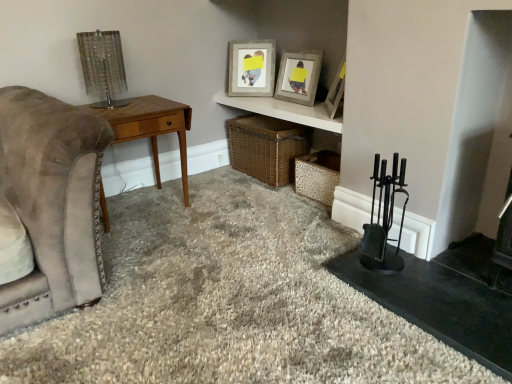
This screenshot has height=384, width=512. Find the location of `free region under metallic mesh lamp at upper left (from a real-world perspective)`. free region under metallic mesh lamp at upper left (from a real-world perspective) is located at coordinates (106, 109).